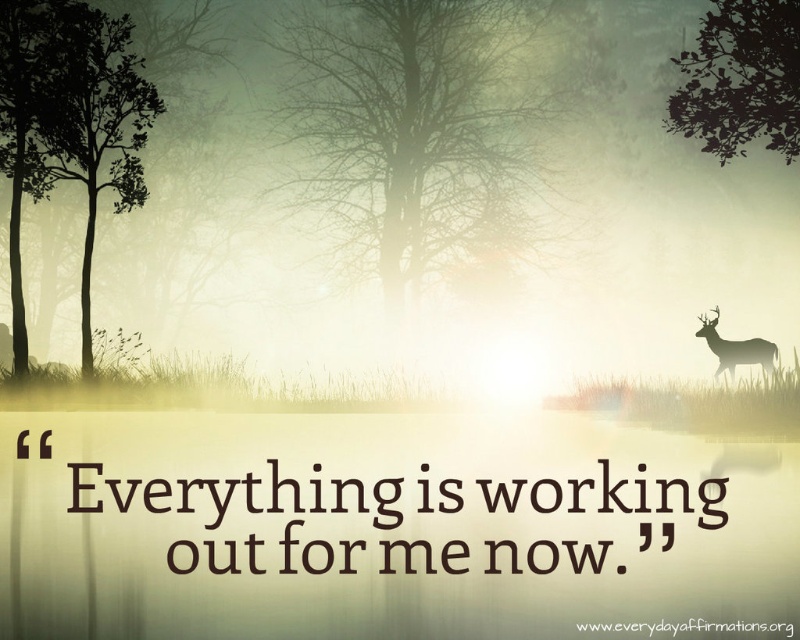
Question: Is green leafy tree at left above silhouette/transparent deer at right?

Choices:
 (A) yes
 (B) no

Answer: (A)

Question: Estimate the real-world distances between objects in this image. Which object is closer to the green leafy tree at left?

Choices:
 (A) silvery branches at center
 (B) silhouette/transparent deer at right

Answer: (A)

Question: Which of the following is the farthest from the observer?

Choices:
 (A) green leafy tree at upper right
 (B) silvery branches at center
 (C) silhouette/transparent deer at right

Answer: (B)

Question: Can you confirm if silvery branches at center is positioned to the left of green leafy tree at left?

Choices:
 (A) yes
 (B) no

Answer: (B)

Question: Which of these objects is positioned farthest from the silvery branches at center?

Choices:
 (A) silhouette/transparent deer at right
 (B) green leafy tree at upper right
 (C) green leafy tree at left

Answer: (A)

Question: Does green leafy tree at left lie in front of green leafy tree at upper right?

Choices:
 (A) no
 (B) yes

Answer: (A)